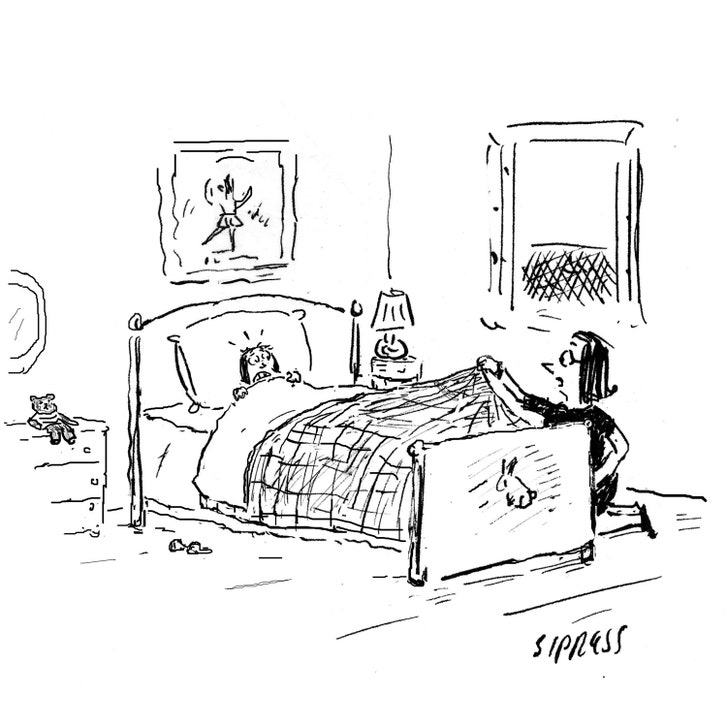
The width and height of the screenshot is (727, 727). Identify the location of hand drawn teddy bear sitting on dresser. (47, 403).